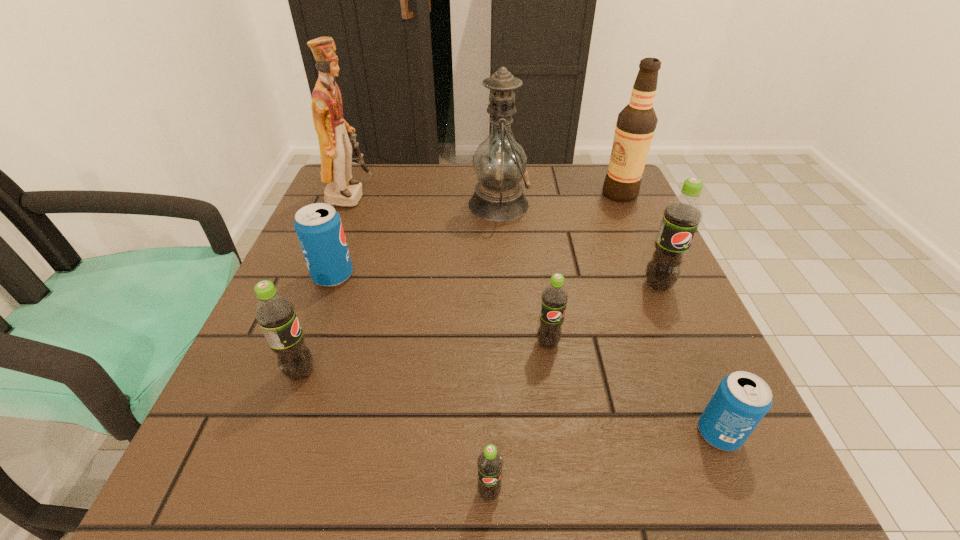
I want to click on object situated at the far left corner, so click(334, 134).

This screenshot has width=960, height=540. I want to click on object that is at the far right corner, so click(636, 123).

Locate an element on the screen. The width and height of the screenshot is (960, 540). object that is at the near right corner is located at coordinates (742, 399).

Where is `vacant position at the far edge of the desktop`? This screenshot has height=540, width=960. vacant position at the far edge of the desktop is located at coordinates (567, 192).

In the image, there is a desktop. At what (x,y) coordinates should I click in order to perform the action: click on vacant space at the near edge. Please return your answer as a coordinate pair (x, y). This screenshot has width=960, height=540. Looking at the image, I should click on (569, 454).

In the image, there is a desktop. Identify the location of vacant space at the left edge. point(271,372).

In the image, there is a desktop. Identify the location of vacant region at the right edge. This screenshot has width=960, height=540. (606, 280).

Image resolution: width=960 pixels, height=540 pixels. Find the location of `blank area at the far left corner`. blank area at the far left corner is located at coordinates (358, 174).

In the image, there is a desktop. Identify the location of vacant space at the near left corner. (175, 508).

Image resolution: width=960 pixels, height=540 pixels. I want to click on vacant space at the far right corner of the desktop, so click(588, 179).